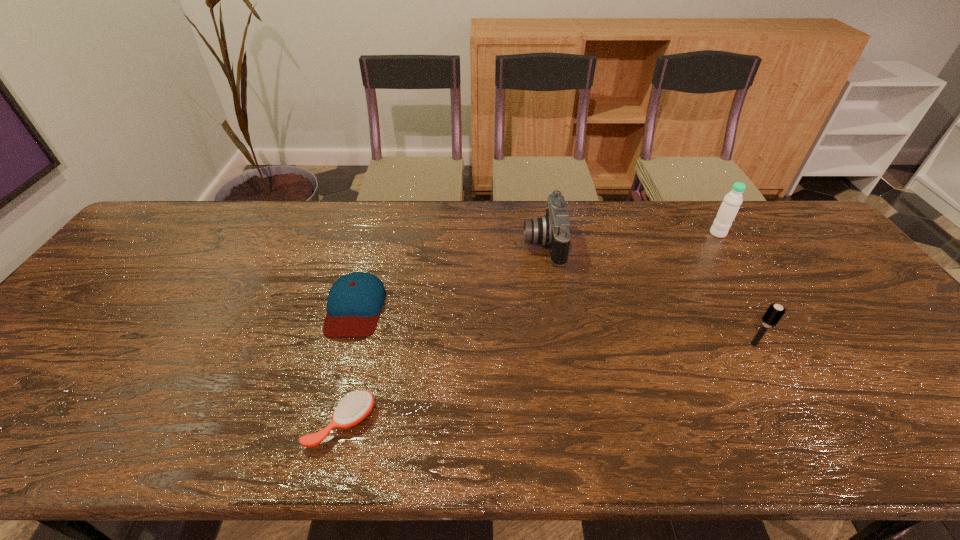
Find the location of a particular element. The height and width of the screenshot is (540, 960). vacant space located on the front-facing side of the camera is located at coordinates (459, 244).

Where is `free space located on the front-facing side of the camera`? The image size is (960, 540). free space located on the front-facing side of the camera is located at coordinates (407, 244).

Where is `blank space located on the right of the second object from right to left`? This screenshot has height=540, width=960. blank space located on the right of the second object from right to left is located at coordinates (870, 345).

You are a GUI agent. You are given a task and a screenshot of the screen. Output one action in this format:
    pyautogui.click(x=<x>, y=<y>)
    Task: Click on the free space located 0.270m with the bill of the fourth tallest object facing forward
    The height and width of the screenshot is (540, 960).
    Given the screenshot: What is the action you would take?
    pyautogui.click(x=318, y=446)

Identify the location of free space located 0.360m on the right of the shortest object. (542, 423).

The image size is (960, 540). I want to click on water bottle at the far edge, so click(728, 210).

Where is `camera present at the far edge`? The height and width of the screenshot is (540, 960). camera present at the far edge is located at coordinates (553, 230).

In order to click on object present at the near edge in this screenshot , I will do `click(356, 406)`.

The width and height of the screenshot is (960, 540). In the image, there is a desktop. Find the location of `vacant space at the far edge`. vacant space at the far edge is located at coordinates (292, 226).

This screenshot has width=960, height=540. What are the coordinates of `free location at the near edge` in the screenshot? It's located at (643, 452).